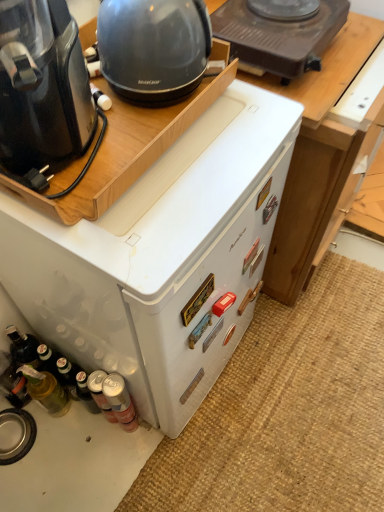
What are the coordinates of `free spot to the right of black plastic coffee maker at left, marked as the second home appliance in a back-to-front arrangement` in the screenshot? It's located at (193, 180).